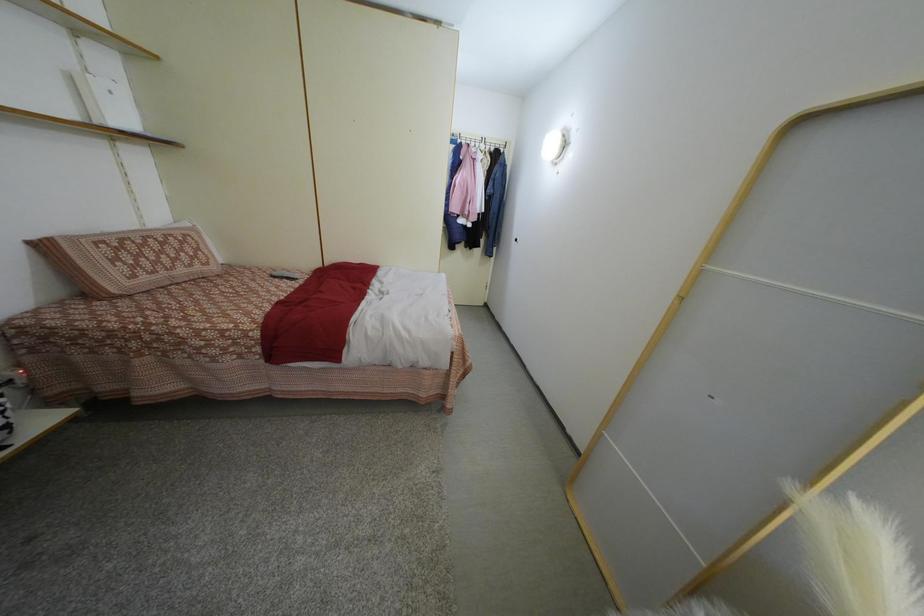
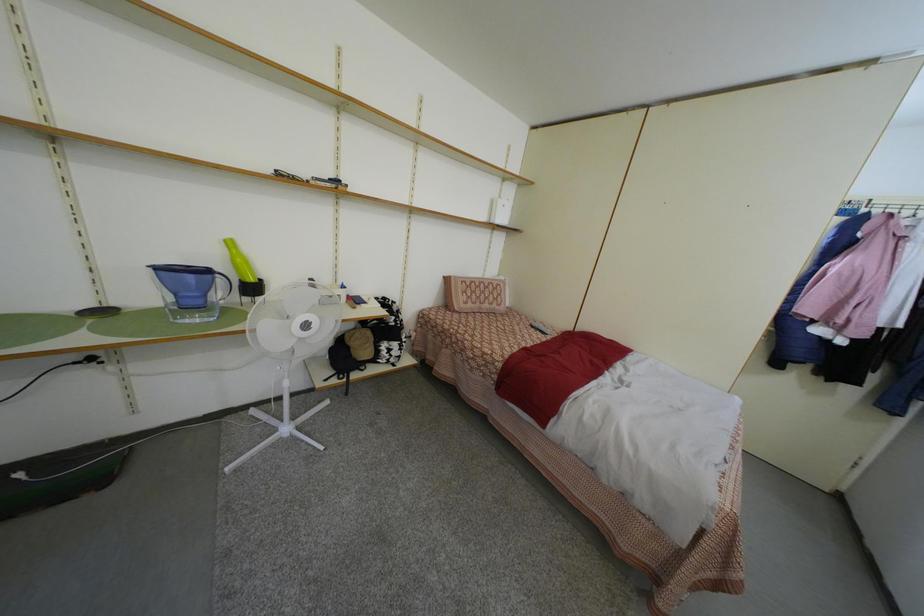
Question: Based on the continuous images, in which direction is the camera rotating? Reply with the corresponding letter.

Choices:
 (A) Left
 (B) Right
 (C) Up
 (D) Down

Answer: (A)